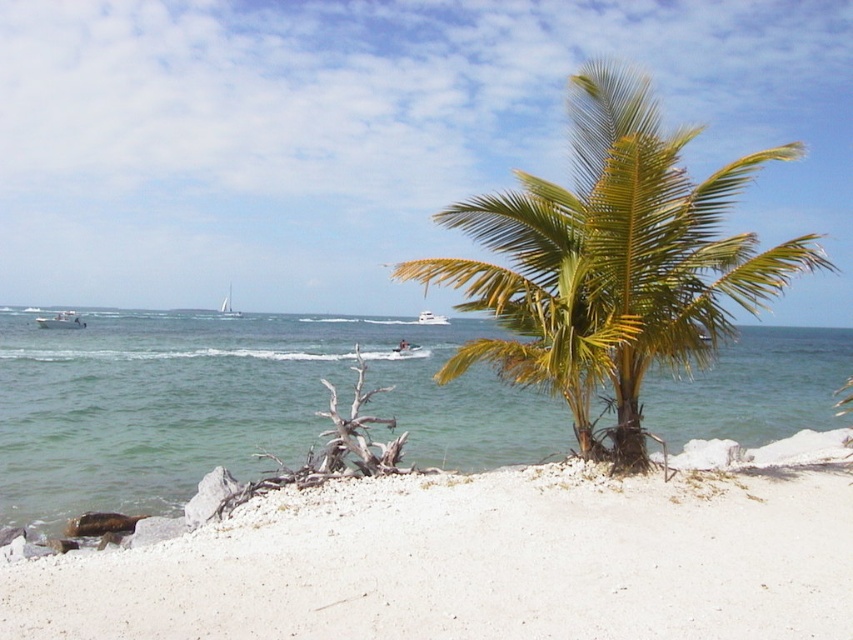
Does green water at center have a greater width compared to white plastic boat at left?

Correct, the width of green water at center exceeds that of white plastic boat at left.

Identify the location of green water at center. Image resolution: width=853 pixels, height=640 pixels. (230, 404).

What are the coordinates of `green water at center` in the screenshot? It's located at (230, 404).

Is green water at center shorter than white sailboat at center?

Yes.

What do you see at coordinates (230, 404) in the screenshot?
I see `green water at center` at bounding box center [230, 404].

Where is `green water at center`? Image resolution: width=853 pixels, height=640 pixels. green water at center is located at coordinates (230, 404).

This screenshot has height=640, width=853. In order to click on green water at center in this screenshot , I will do `click(230, 404)`.

Is green water at center in front of white glossy boat at center?

That is True.

Is point (332, 323) closer to viewer compared to point (418, 314)?

Yes, point (332, 323) is closer to viewer.

The width and height of the screenshot is (853, 640). Identify the location of green water at center. (230, 404).